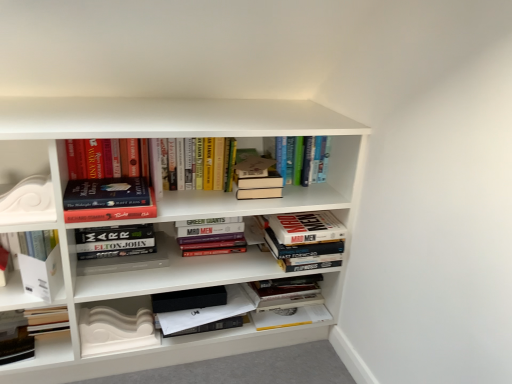
What do you see at coordinates (115, 330) in the screenshot?
I see `white matte decorative piece at lower left, which ranks as the first paperback book in right-to-left order` at bounding box center [115, 330].

Find the location of a particular element. The width and height of the screenshot is (512, 384). hardcover book at upper center, which is counted as the first book, starting from the right is located at coordinates (302, 159).

Describe the element at coordinates (212, 239) in the screenshot. I see `hardcover books at center, which is the 4th book in right-to-left order` at that location.

Find the location of a particular element. The width and height of the screenshot is (512, 384). hardcover book at center, acting as the fourth book starting from the left is located at coordinates (257, 179).

Describe the element at coordinates (42, 275) in the screenshot. The height and width of the screenshot is (384, 512). I see `white matte book at lower left, the 2th paperback book when ordered from bottom to top` at that location.

Locate an element on the screen. hardcover book at center, which appears as the 2th book when viewed from the right is located at coordinates (305, 240).

Looking at the image, does hardcover books at center, which is the 4th book in right-to-left order, seem bigger or smaller compared to hardcover book at lower left, acting as the 6th book starting from the right?

In the image, hardcover books at center, which is the 4th book in right-to-left order, appears to be larger than hardcover book at lower left, acting as the 6th book starting from the right.

How far apart are hardcover books at center, arranged as the third book when viewed from the left, and hardcover book at lower left, acting as the 6th book starting from the right?

25.03 inches.

From the image's perspective, is hardcover books at center, which is the 4th book in right-to-left order, under hardcover book at lower left, acting as the 6th book starting from the right?

No, from the image's perspective, hardcover books at center, which is the 4th book in right-to-left order, is not beneath hardcover book at lower left, acting as the 6th book starting from the right.

Between hardcover books at center, which is the 4th book in right-to-left order, and hardcover book at lower left, acting as the 6th book starting from the right, which one appears on the left side from the viewer's perspective?

From the viewer's perspective, hardcover book at lower left, acting as the 6th book starting from the right, appears more on the left side.

From a real-world perspective, which is physically below, hardcover book at center, which appears as the 2th book when viewed from the right, or hardcover book at lower left, the first book positioned from the left?

In real-world perspective, hardcover book at lower left, the first book positioned from the left, is lower.

Which is in front, point (285, 251) or point (0, 312)?

The point (0, 312) is in front.

Consider the image. Which object is more forward, hardcover book at center, which appears as the 2th book when viewed from the right, or hardcover book at lower left, the first book positioned from the left?

hardcover book at lower left, the first book positioned from the left.

Considering the relative positions of hardcover book at center, the fifth book in the left-to-right sequence, and hardcover book at lower left, the first book positioned from the left, in the image provided, is hardcover book at center, the fifth book in the left-to-right sequence, to the left of hardcover book at lower left, the first book positioned from the left, from the viewer's perspective?

No, hardcover book at center, the fifth book in the left-to-right sequence, is not to the left of hardcover book at lower left, the first book positioned from the left.

Between hardcover book at center, the 3th book positioned from the right, and hardcover book at center, the fifth book in the left-to-right sequence, which one has smaller size?

With smaller size is hardcover book at center, the 3th book positioned from the right.

Are hardcover book at center, acting as the fourth book starting from the left, and hardcover book at center, which appears as the 2th book when viewed from the right, making contact?

No, hardcover book at center, acting as the fourth book starting from the left, is not with hardcover book at center, which appears as the 2th book when viewed from the right.

Visually, is hardcover book at center, the 3th book positioned from the right, positioned to the left or to the right of hardcover book at center, which appears as the 2th book when viewed from the right?

hardcover book at center, the 3th book positioned from the right, is to the left of hardcover book at center, which appears as the 2th book when viewed from the right.

Considering the relative sizes of hardcover book at center, acting as the fourth book starting from the left, and hardcover book at center, which appears as the 2th book when viewed from the right, in the image provided, is hardcover book at center, acting as the fourth book starting from the left, taller than hardcover book at center, which appears as the 2th book when viewed from the right,?

No, hardcover book at center, acting as the fourth book starting from the left, is not taller than hardcover book at center, which appears as the 2th book when viewed from the right.

How different are the orientations of white matte decorative piece at lower left, the 1th paperback book in the back-to-front sequence, and hardcover book at lower left, the first book positioned from the left, in degrees?

white matte decorative piece at lower left, the 1th paperback book in the back-to-front sequence, and hardcover book at lower left, the first book positioned from the left, are facing 4.67 degrees away from each other.

Does white matte decorative piece at lower left, which ranks as the first paperback book in right-to-left order, have a lesser width compared to hardcover book at lower left, acting as the 6th book starting from the right?

Correct, the width of white matte decorative piece at lower left, which ranks as the first paperback book in right-to-left order, is less than that of hardcover book at lower left, acting as the 6th book starting from the right.

Is white matte decorative piece at lower left, arranged as the 2th paperback book when viewed from the front, not inside hardcover book at lower left, acting as the 6th book starting from the right?

Absolutely, white matte decorative piece at lower left, arranged as the 2th paperback book when viewed from the front, is external to hardcover book at lower left, acting as the 6th book starting from the right.

Does point (135, 328) come in front of point (32, 352)?

No.

Considering the relative positions of white glossy decorative element at left and hardcover book at lower left, acting as the 6th book starting from the right, in the image provided, is white glossy decorative element at left to the right of hardcover book at lower left, acting as the 6th book starting from the right, from the viewer's perspective?

Correct, you'll find white glossy decorative element at left to the right of hardcover book at lower left, acting as the 6th book starting from the right.

Considering the points (21, 192) and (10, 316), which point is behind, point (21, 192) or point (10, 316)?

The point (10, 316) is farther from the camera.

From the image's perspective, is white glossy decorative element at left over hardcover book at lower left, acting as the 6th book starting from the right?

Yes, from the image's perspective, white glossy decorative element at left is over hardcover book at lower left, acting as the 6th book starting from the right.

From their relative heights in the image, would you say white glossy decorative element at left is taller or shorter than hardcover book at lower left, acting as the 6th book starting from the right?

white glossy decorative element at left is taller than hardcover book at lower left, acting as the 6th book starting from the right.

Image resolution: width=512 pixels, height=384 pixels. Identify the location of the 1st paperback book located beneath the hardcover book at upper left, arranged as the second book when viewed from the left (from a real-world perspective). (42, 275).

Is hardcover book at upper left, the fifth book viewed from the right, surrounding white matte book at lower left, which is counted as the 1th paperback book, starting from the front?

No, white matte book at lower left, which is counted as the 1th paperback book, starting from the front, is not a part of hardcover book at upper left, the fifth book viewed from the right.

How much distance is there between hardcover book at upper left, arranged as the second book when viewed from the left, and white matte book at lower left, which ranks as the second paperback book in back-to-front order?

They are 9.49 inches apart.

Looking at this image, is hardcover book at upper left, the fifth book viewed from the right, closer to camera compared to white matte book at lower left, the first paperback book from the left?

Yes, it is in front of white matte book at lower left, the first paperback book from the left.

Consider the image. Is hardcover books at center, arranged as the third book when viewed from the left, to the right of white matte book at lower left, the first paperback book from the left, from the viewer's perspective?

Correct, you'll find hardcover books at center, arranged as the third book when viewed from the left, to the right of white matte book at lower left, the first paperback book from the left.

Between hardcover books at center, which is the 4th book in right-to-left order, and white matte book at lower left, the first paperback book from the left, which one has more height?

Standing taller between the two is white matte book at lower left, the first paperback book from the left.

Is white matte book at lower left, which is counted as the 1th paperback book, starting from the front, completely or partially inside hardcover books at center, arranged as the third book when viewed from the left?

No.

You are a GUI agent. You are given a task and a screenshot of the screen. Output one action in this format:
    pyautogui.click(x=<x>, y=<y>)
    Task: Click on the 2nd book above the hardcover book at lower left, acting as the 6th book starting from the right (from the image's perspective)
    Image resolution: width=512 pixels, height=384 pixels.
    Given the screenshot: What is the action you would take?
    pyautogui.click(x=212, y=239)

Starting from the hardcover book at lower left, the first book positioned from the left, which book is the 2nd one behind? Please provide its 2D coordinates.

[(305, 240)]

When comparing their distances from hardcover book at upper left, the fifth book viewed from the right, does white matte decorative piece at lower left, which ranks as the 2th paperback book in left-to-right order, or hardcover books at center, arranged as the third book when viewed from the left, seem further?

white matte decorative piece at lower left, which ranks as the 2th paperback book in left-to-right order, is further to hardcover book at upper left, the fifth book viewed from the right.

From the image, which object appears to be nearer to white glossy decorative element at left, hardcover book at lower left, acting as the 6th book starting from the right, or hardcover book at upper left, the fifth book viewed from the right?

Among the two, hardcover book at upper left, the fifth book viewed from the right, is located nearer to white glossy decorative element at left.

When comparing their distances from hardcover books at center, arranged as the third book when viewed from the left, does hardcover book at lower left, the first book positioned from the left, or white matte book at lower left, acting as the 1th paperback book starting from the top, seem closer?

The object closer to hardcover books at center, arranged as the third book when viewed from the left, is white matte book at lower left, acting as the 1th paperback book starting from the top.

When comparing their distances from hardcover book at upper left, arranged as the second book when viewed from the left, does hardcover book at center, which appears as the 2th book when viewed from the right, or white matte decorative piece at lower left, arranged as the second paperback book when viewed from the top, seem further?

Based on the image, hardcover book at center, which appears as the 2th book when viewed from the right, appears to be further to hardcover book at upper left, arranged as the second book when viewed from the left.

When comparing their distances from hardcover book at center, the 3th book positioned from the right, does hardcover book at lower left, acting as the 6th book starting from the right, or white glossy decorative element at left seem closer?

The object closer to hardcover book at center, the 3th book positioned from the right, is white glossy decorative element at left.

Estimate the real-world distances between objects in this image. Which object is further from hardcover book at upper left, arranged as the second book when viewed from the left, white matte book at lower left, the 2th paperback book when ordered from bottom to top, or white matte decorative piece at lower left, arranged as the 2th paperback book when viewed from the front?

white matte decorative piece at lower left, arranged as the 2th paperback book when viewed from the front, is positioned further to the anchor hardcover book at upper left, arranged as the second book when viewed from the left.

When comparing their distances from hardcover books at center, arranged as the third book when viewed from the left, does hardcover book at center, which appears as the 2th book when viewed from the right, or hardcover book at lower left, the first book positioned from the left, seem closer?

hardcover book at center, which appears as the 2th book when viewed from the right, is positioned closer to the anchor hardcover books at center, arranged as the third book when viewed from the left.

When comparing their distances from hardcover books at center, which is the 4th book in right-to-left order, does white matte book at lower left, which is counted as the 1th paperback book, starting from the front, or hardcover book at center, which appears as the 2th book when viewed from the right, seem further?

Among the two, white matte book at lower left, which is counted as the 1th paperback book, starting from the front, is located further to hardcover books at center, which is the 4th book in right-to-left order.

Locate an element on the screen. The height and width of the screenshot is (384, 512). book between hardcover book at upper left, arranged as the second book when viewed from the left, and hardcover book at center, acting as the fourth book starting from the left, in the horizontal direction is located at coordinates (212, 239).

At what (x,y) coordinates should I click in order to perform the action: click on paperback book between hardcover book at upper left, the fifth book viewed from the right, and white matte decorative piece at lower left, the 1th paperback book in the back-to-front sequence, in the vertical direction. Please return your answer as a coordinate pair (x, y). Looking at the image, I should click on (42, 275).

I want to click on shelf located between hardcover book at lower left, the first book positioned from the left, and hardcover books at center, arranged as the third book when viewed from the left, in the left-right direction, so click(x=25, y=183).

Locate an element on the screen. shelf located between hardcover book at lower left, acting as the 6th book starting from the right, and hardcover book at upper center, which is counted as the first book, starting from the right, in the left-right direction is located at coordinates click(25, 183).